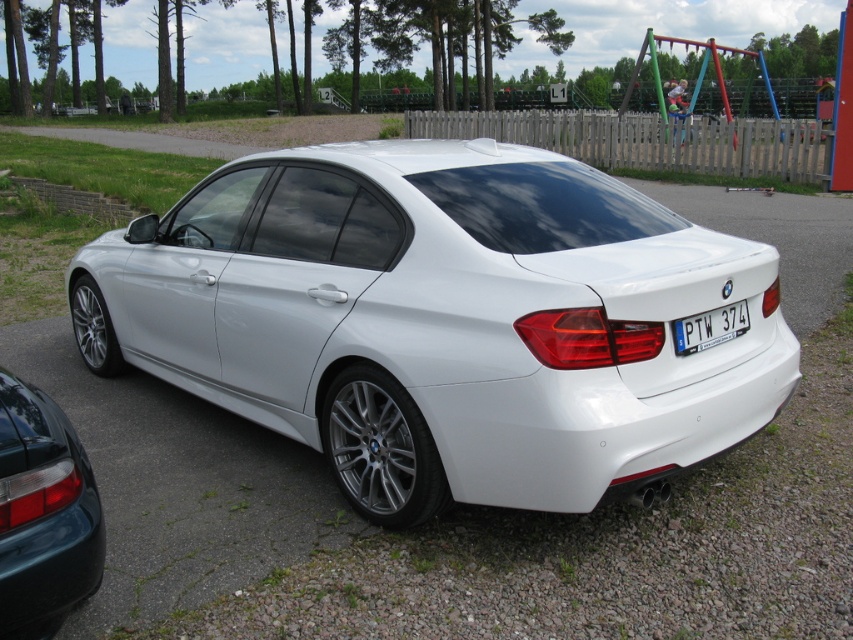
Between white glossy sedan at center and brick at lower left, which one has more height?

white glossy sedan at center is taller.

Can you confirm if white glossy sedan at center is positioned to the right of brick at lower left?

Indeed, white glossy sedan at center is positioned on the right side of brick at lower left.

Image resolution: width=853 pixels, height=640 pixels. Describe the element at coordinates (444, 321) in the screenshot. I see `white glossy sedan at center` at that location.

Find the location of `white glossy sedan at center`. white glossy sedan at center is located at coordinates click(x=444, y=321).

Who is shorter, white glossy car at center or white plastic license plate at rear?

Standing shorter between the two is white plastic license plate at rear.

Does white glossy car at center appear on the left side of white plastic license plate at rear?

No, white glossy car at center is not to the left of white plastic license plate at rear.

Is point (717, 218) farther from camera compared to point (723, 321)?

Yes, it is behind point (723, 321).

The image size is (853, 640). I want to click on white glossy car at center, so [x=776, y=237].

Between white glossy car at center and brick at lower left, which one has less height?

With less height is brick at lower left.

Does white glossy car at center lie behind brick at lower left?

No, white glossy car at center is in front of brick at lower left.

The width and height of the screenshot is (853, 640). I want to click on white glossy car at center, so click(x=776, y=237).

I want to click on white glossy car at center, so click(x=776, y=237).